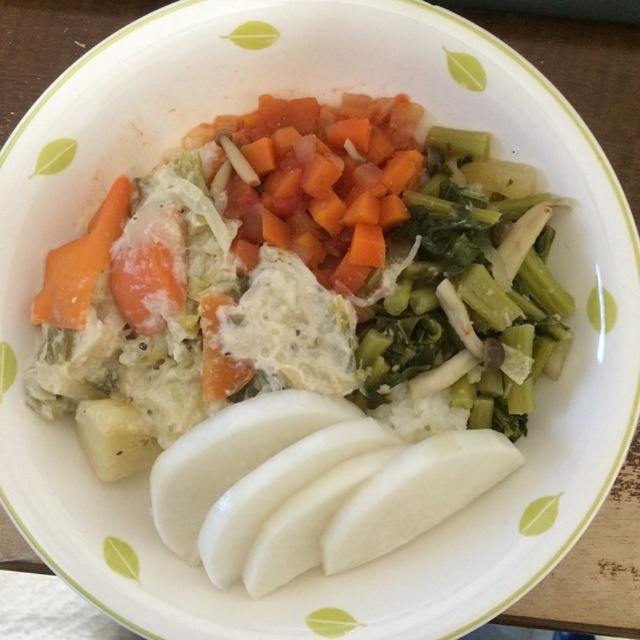
Can you confirm if diced orange carrot at center is positioned to the right of orange matte carrot at left?

Indeed, diced orange carrot at center is positioned on the right side of orange matte carrot at left.

Looking at this image, measure the distance between diced orange carrot at center and camera.

3.75 feet

Identify the location of diced orange carrot at center. (321, 179).

The width and height of the screenshot is (640, 640). Describe the element at coordinates (467, 296) in the screenshot. I see `green leafy vegetable at center` at that location.

Which is more to the left, green leafy vegetable at center or diced orange carrot at center?

diced orange carrot at center

Is point (488, 358) closer to viewer compared to point (385, 134)?

Yes, point (488, 358) is closer to viewer.

You are a GUI agent. You are given a task and a screenshot of the screen. Output one action in this format:
    pyautogui.click(x=<x>, y=<y>)
    Task: Click on the green leafy vegetable at center
    
    Given the screenshot: What is the action you would take?
    pyautogui.click(x=467, y=296)

Which is more to the left, green leafy vegetable at center or orange matte carrot at left?

orange matte carrot at left

This screenshot has height=640, width=640. Describe the element at coordinates (467, 296) in the screenshot. I see `green leafy vegetable at center` at that location.

The height and width of the screenshot is (640, 640). What are the coordinates of `green leafy vegetable at center` in the screenshot? It's located at (467, 296).